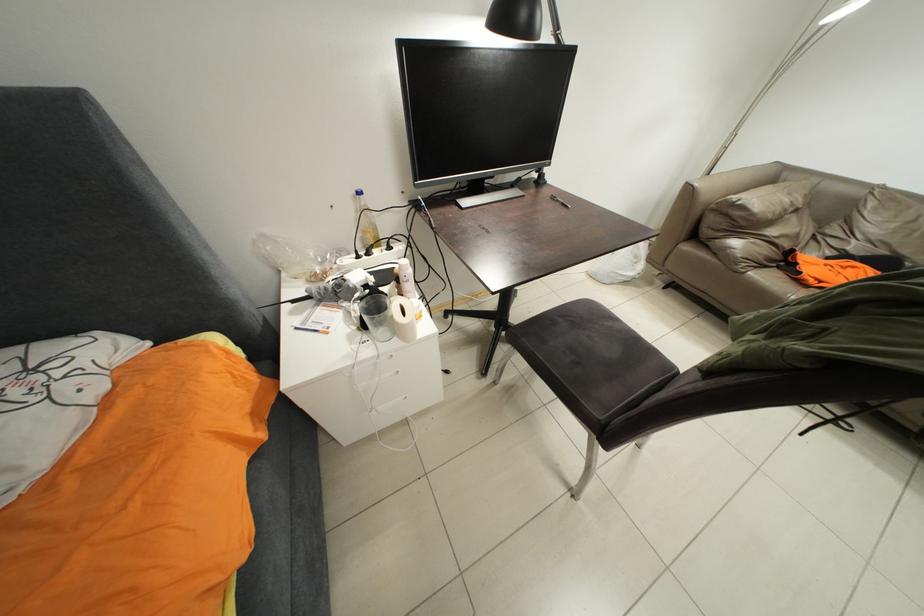
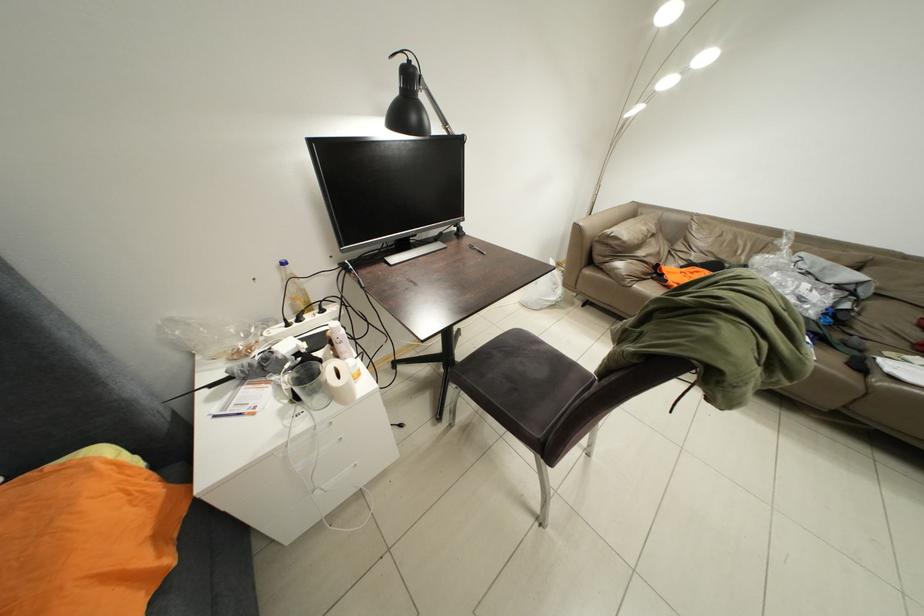
Question: Based on the continuous images, in which direction is the camera rotating? Reply with the corresponding letter.

Choices:
 (A) Left
 (B) Right
 (C) Up
 (D) Down

Answer: (B)